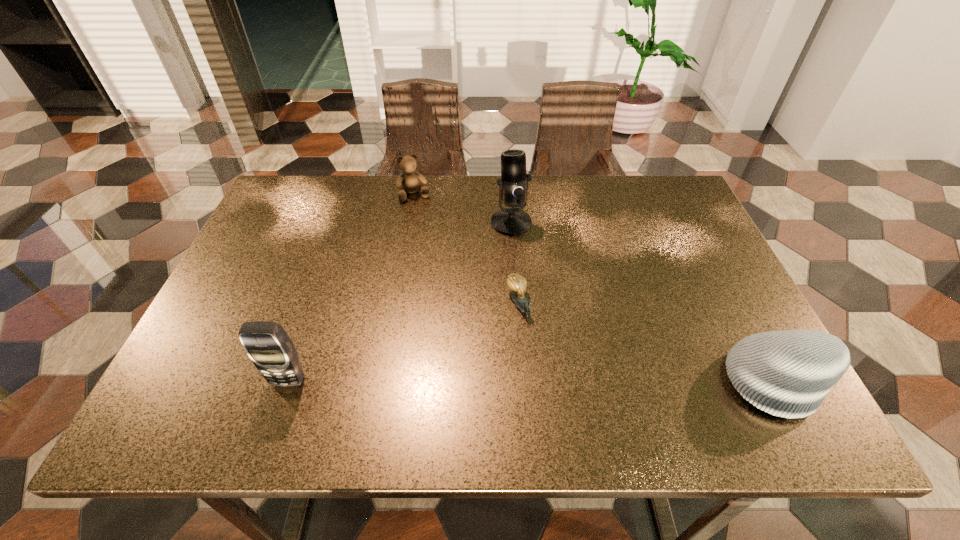
Image resolution: width=960 pixels, height=540 pixels. Find the location of `free point located 0.210m on the stand of the tallest object`. free point located 0.210m on the stand of the tallest object is located at coordinates (521, 293).

Identify the location of vacant space located 0.400m on the stand of the tallest object. (532, 361).

Where is `vacant space situated 0.290m on the stand of the tallest object`? The height and width of the screenshot is (540, 960). vacant space situated 0.290m on the stand of the tallest object is located at coordinates (x=526, y=320).

You are a GUI agent. You are given a task and a screenshot of the screen. Output one action in this format:
    pyautogui.click(x=<x>, y=<y>)
    Task: Click on the free space located on the front-facing side of the teddy bear
    Image resolution: width=960 pixels, height=540 pixels.
    Given the screenshot: What is the action you would take?
    pyautogui.click(x=434, y=249)

The width and height of the screenshot is (960, 540). In order to click on vacant space located on the front-facing side of the teddy bear in this screenshot , I will do `click(452, 298)`.

Identify the location of free space located 0.260m on the front-facing side of the teddy bear. (439, 262).

At what (x,y) coordinates should I click in order to perform the action: click on free spot located on the front-facing side of the shortest object. Please return your answer as a coordinate pair (x, y). Looking at the image, I should click on (545, 376).

Where is `free space located on the front-facing side of the shortest object`? free space located on the front-facing side of the shortest object is located at coordinates (551, 388).

At what (x,y) coordinates should I click in order to perform the action: click on free location located on the front-facing side of the shortest object. Please return your answer as a coordinate pair (x, y). This screenshot has height=540, width=960. Looking at the image, I should click on (540, 363).

This screenshot has height=540, width=960. What are the coordinates of `microphone situated at the far edge` in the screenshot? It's located at (513, 185).